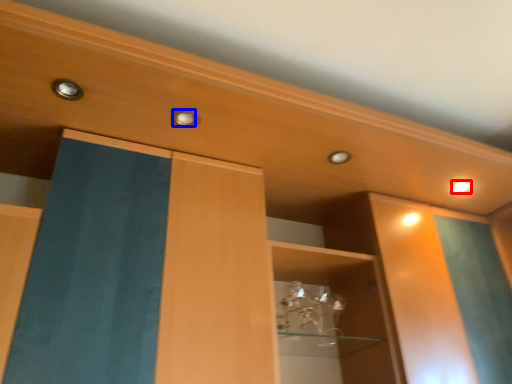
Question: Which object is further to the camera taking this photo, lighting (highlighted by a red box) or knob (highlighted by a blue box)?

Choices:
 (A) lighting
 (B) knob

Answer: (A)